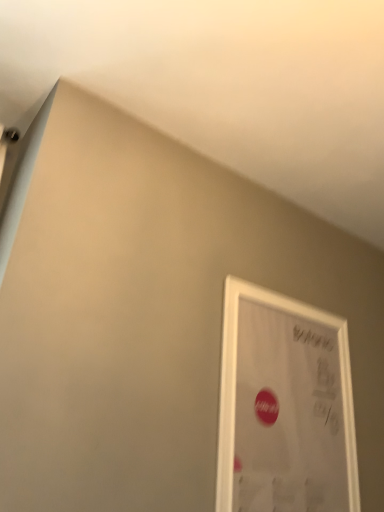
Describe the element at coordinates (284, 407) in the screenshot. I see `white matte picture frame at lower right` at that location.

Find the location of a particular element. white matte picture frame at lower right is located at coordinates (284, 407).

At what (x,y) coordinates should I click in order to perform the action: click on white matte picture frame at lower right. Please return your answer as a coordinate pair (x, y). Looking at the image, I should click on (284, 407).